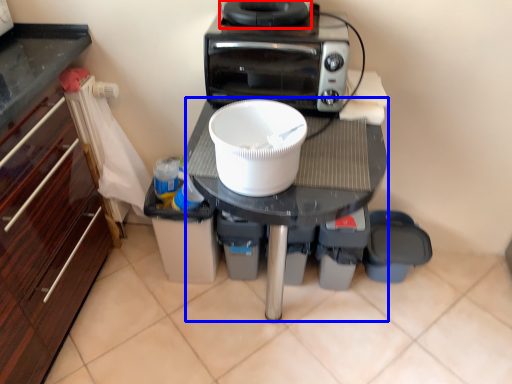
Question: Which point is further to the camera, appliance (highlighted by a red box) or table (highlighted by a blue box)?

Choices:
 (A) appliance
 (B) table

Answer: (A)